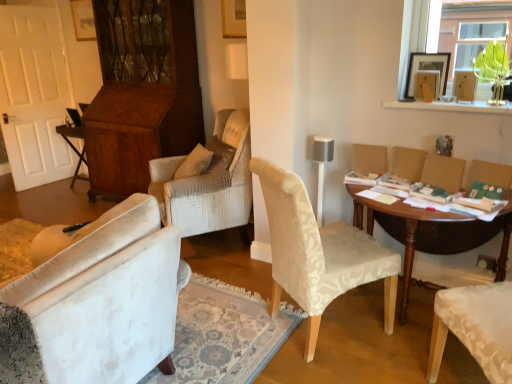
At what (x,y) coordinates should I click in order to perform the action: click on blank area to the left of transparent glass vase at upper right. Please return your answer as a coordinate pair (x, y). Image resolution: width=512 pixels, height=384 pixels. Looking at the image, I should click on (471, 110).